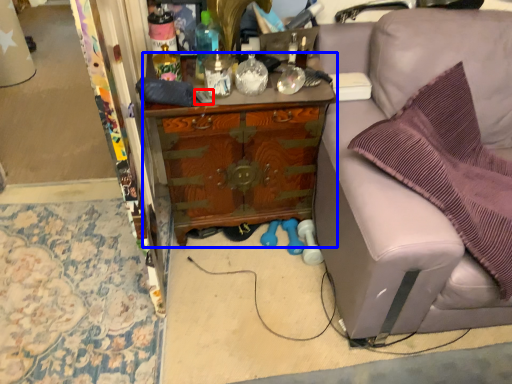
Question: Among these objects, which one is nearest to the camera, remote control (highlighted by a red box) or cabinetry (highlighted by a blue box)?

Choices:
 (A) remote control
 (B) cabinetry

Answer: (B)